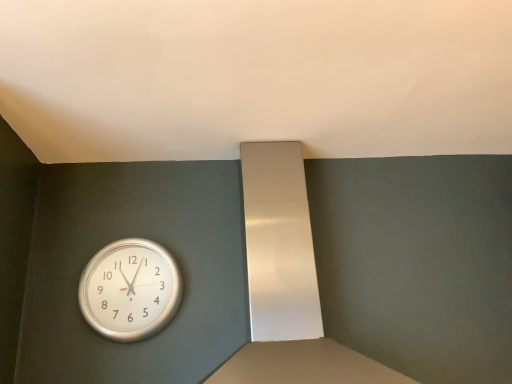
Based on the photo, in order to face silver metallic clock at lower left, should I rotate leftwards or rightwards?

A 16.100 degree turn to the left will do.

Locate an element on the screen. silver metallic clock at lower left is located at coordinates (130, 290).

The height and width of the screenshot is (384, 512). Describe the element at coordinates (130, 290) in the screenshot. I see `silver metallic clock at lower left` at that location.

Where is `silver metallic clock at lower left`? The width and height of the screenshot is (512, 384). silver metallic clock at lower left is located at coordinates (130, 290).